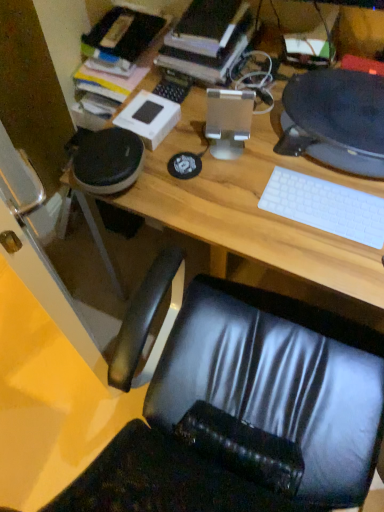
This screenshot has width=384, height=512. Find the location of `vacant space behind white matte keyboard at right`. vacant space behind white matte keyboard at right is located at coordinates (298, 160).